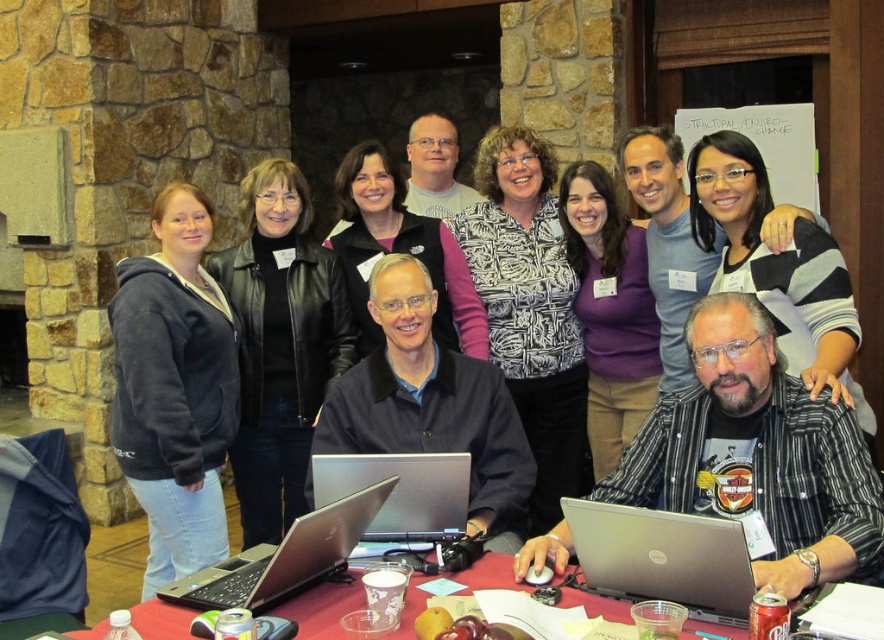
Looking at this image, you are organizing a photo shoot and need to position two models wearing the dark gray fleece jacket at left and the black matte jacket at center. Based on the scene description, which jacket is positioned closer to the left side of the table?

The dark gray fleece jacket at left is positioned closer to the left side of the table because it is to the left of the black matte jacket at center.

You are a photographer trying to capture a clear shot of the silver metallic laptop at center without the dark gray fleece jacket at left blocking the view. Based on their heights, is this possible?

The dark gray fleece jacket at left has a greater height compared to the silver metallic laptop at center, so it may block the view of the laptop. To capture a clear shot, you might need to adjust your angle or position to avoid the jacket.

You are organizing a presentation and need to place both the silver metallic laptop at center and the satin silver laptop at center on a table that can only accommodate one of them. Which laptop should you choose to ensure it fits?

The satin silver laptop at center is smaller in width than the silver metallic laptop at center, so you should choose the satin silver laptop at center to ensure it fits on the table.